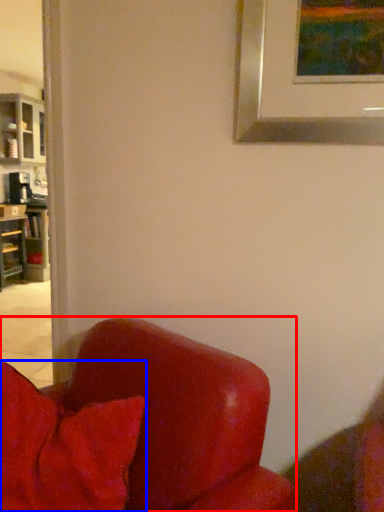
Question: Which object appears farthest to the camera in this image, chair (highlighted by a red box) or pillow (highlighted by a blue box)?

Choices:
 (A) chair
 (B) pillow

Answer: (B)